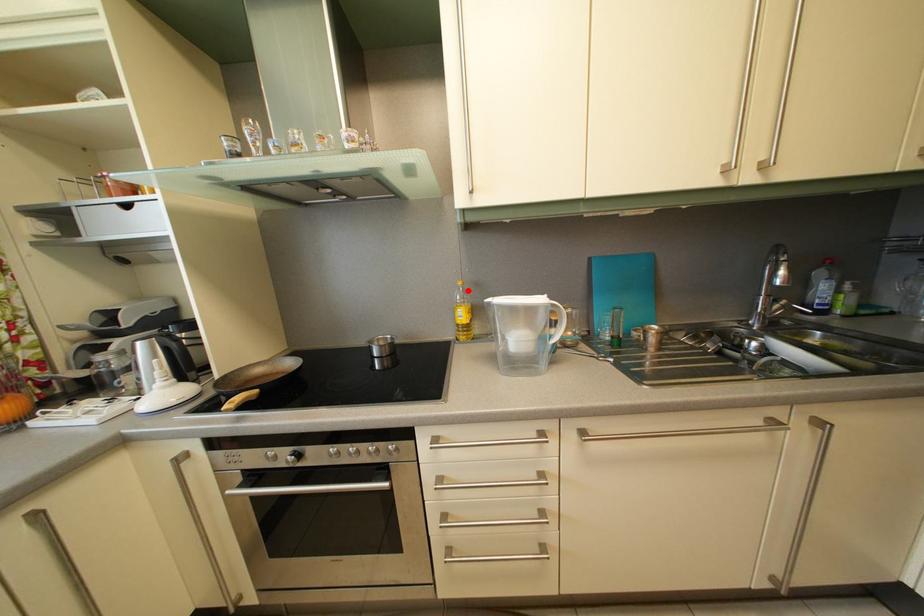
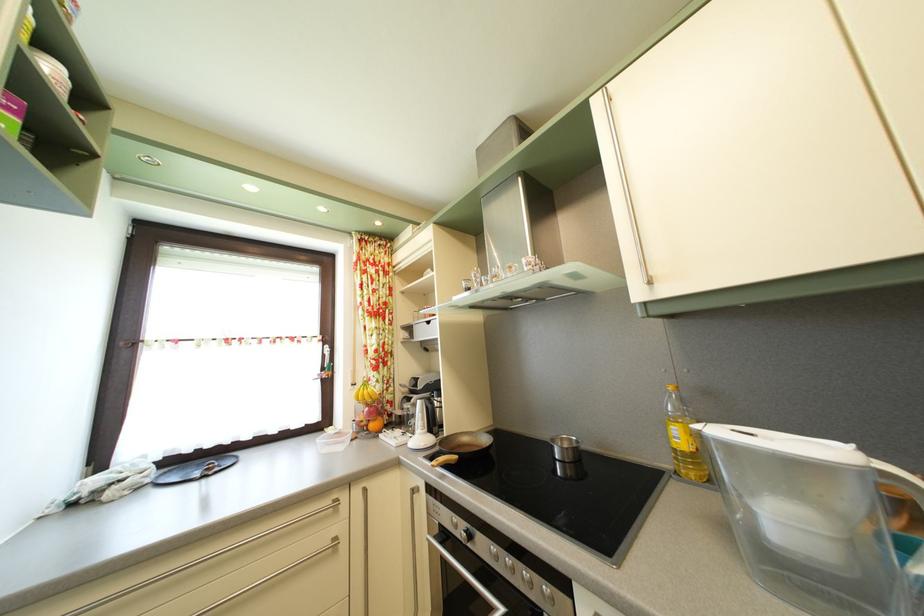
The point at the highlighted location is marked in the first image. Where is the corresponding point in the second image?

(678, 395)